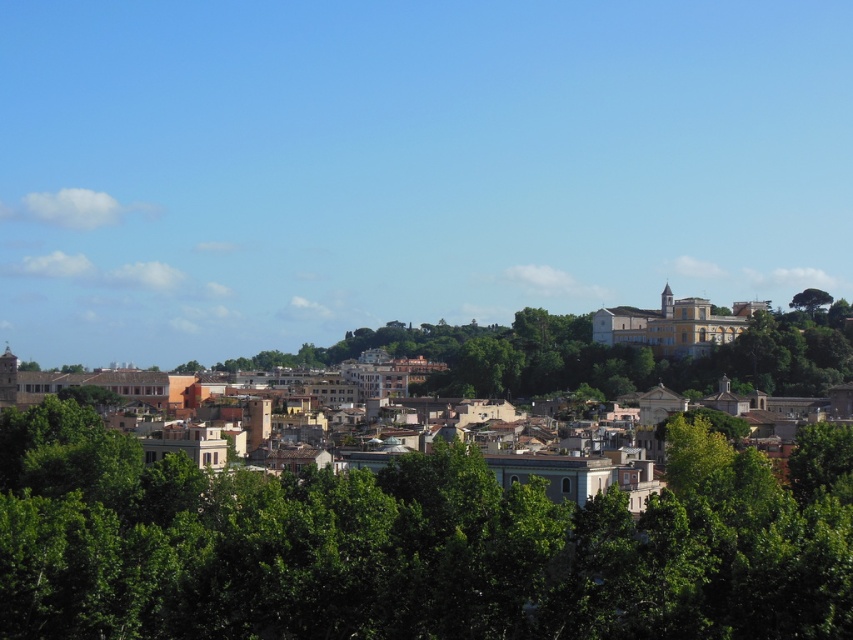
Can you confirm if green leafy tree at center is thinner than yellowish stone buildings at center?

Indeed, green leafy tree at center has a lesser width compared to yellowish stone buildings at center.

Where is `green leafy tree at center`? green leafy tree at center is located at coordinates (397, 548).

Which is behind, point (3, 484) or point (55, 385)?

The point (55, 385) is more distant.

Identify the location of green leafy tree at center. This screenshot has height=640, width=853. (397, 548).

Consider the image. Can you confirm if yellowish stone buildings at center is bigger than green leafy tree at upper right?

Correct, yellowish stone buildings at center is larger in size than green leafy tree at upper right.

What do you see at coordinates (618, 356) in the screenshot? I see `yellowish stone buildings at center` at bounding box center [618, 356].

The height and width of the screenshot is (640, 853). I want to click on yellowish stone buildings at center, so click(618, 356).

Is green leafy tree at center bigger than green leafy tree at upper right?

Correct, green leafy tree at center is larger in size than green leafy tree at upper right.

The height and width of the screenshot is (640, 853). Describe the element at coordinates (397, 548) in the screenshot. I see `green leafy tree at center` at that location.

Who is more forward, (x=241, y=595) or (x=821, y=296)?

Positioned in front is point (x=241, y=595).

The height and width of the screenshot is (640, 853). I want to click on green leafy tree at center, so click(x=397, y=548).